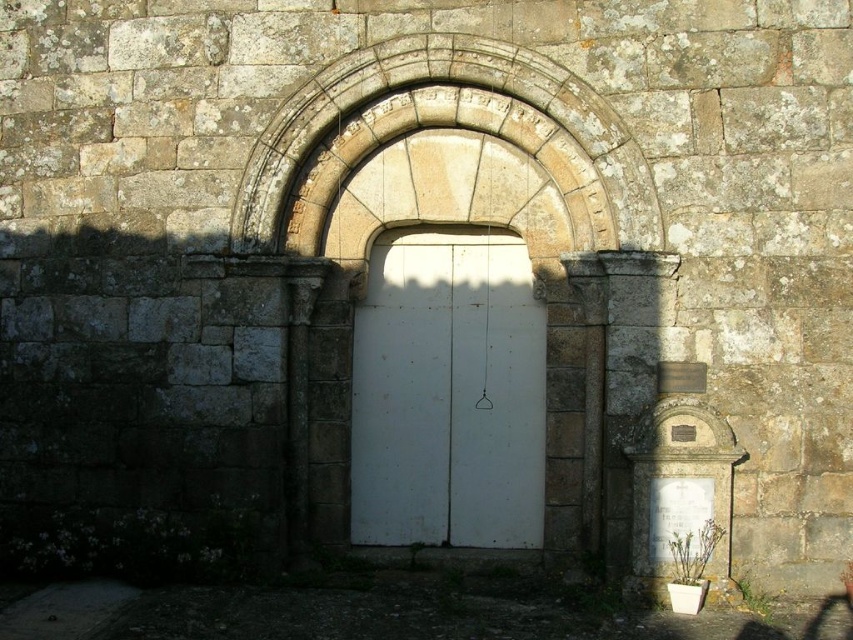
You are an architect designing a new entrance. You want to ensure the door is proportionate to the archway. Given the scene, does the white matte door at center fit well in terms of size relative to the stone textured archway at center?

The white matte door at center has a smaller size compared to the stone textured archway at center, so it fits well in terms of size as it is proportionate and not oversized for the archway.

From the picture: You are an architect designing a new entranceway. You have a white matte door at center that needs to fit within a stone textured archway at center. Based on the scene, will the door fit through the archway?

The white matte door at center is thinner than the stone textured archway at center, so it will fit through the archway.